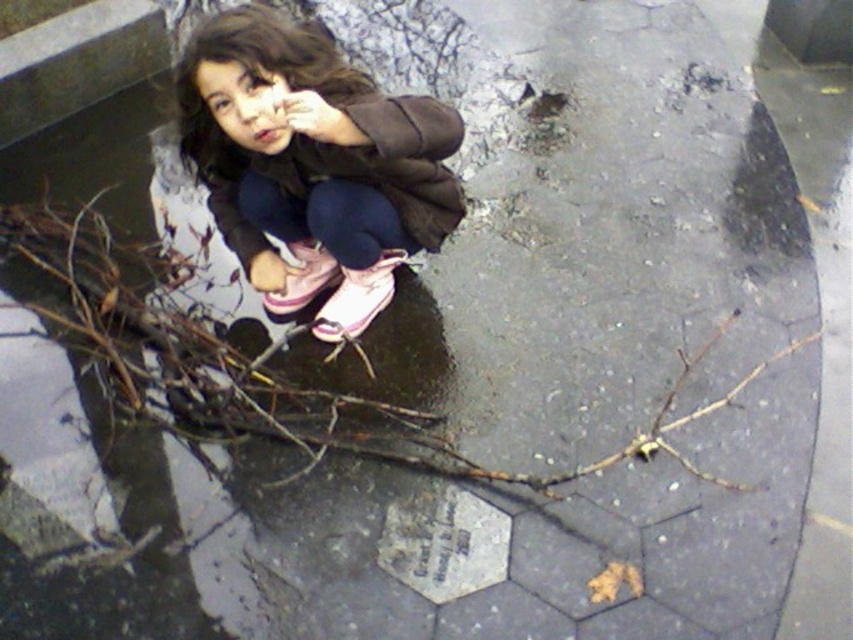
The scene shows a young girl on a wet pavement. Where exactly is the matte brown jacket at upper center located in terms of coordinates?

The matte brown jacket at upper center is located at coordinates point (312, 164).

You are a photographer trying to capture the reflection of the matte brown jacket at upper center and the brown wood branch at center in the puddle. Given that the puddle is 10 inches wide, can both objects be fully reflected in the puddle?

The matte brown jacket at upper center is 17.75 inches from the brown wood branch at center. Since the distance between them exceeds the puddle width of 10 inches, the entire jacket and branch cannot be reflected together in the puddle.

You are a fashion designer observing the scene. You need to decide which item is higher up in the image between the matte brown jacket at upper center and the brown wood branch at center. Which one is taller?

The matte brown jacket at upper center is taller than the brown wood branch at center.